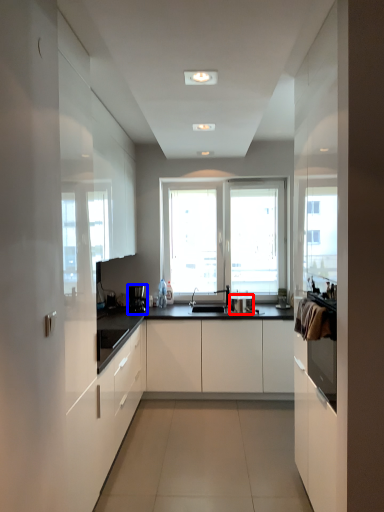
Question: Which of the following is the closest to the observer, appliance (highlighted by a red box) or coffee machine (highlighted by a blue box)?

Choices:
 (A) appliance
 (B) coffee machine

Answer: (A)